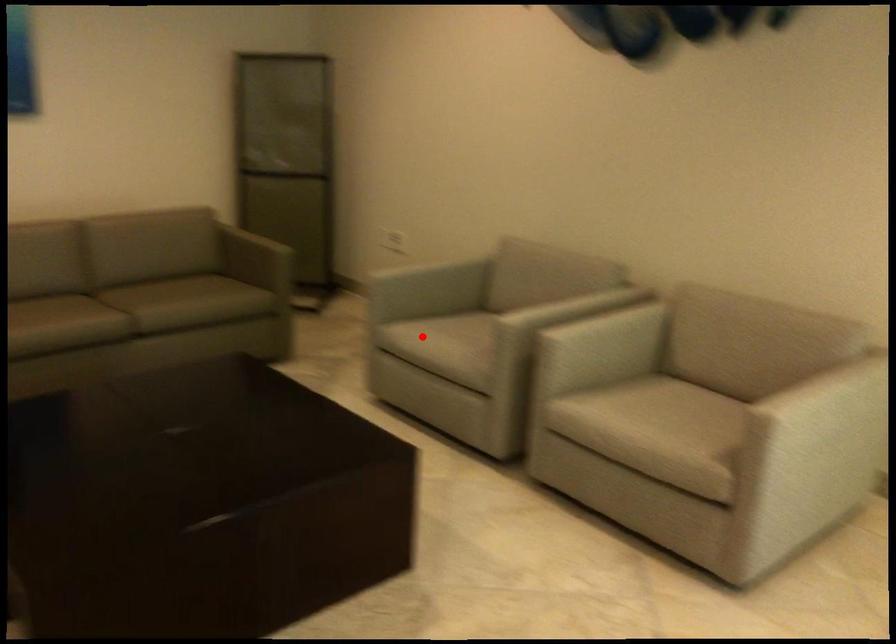
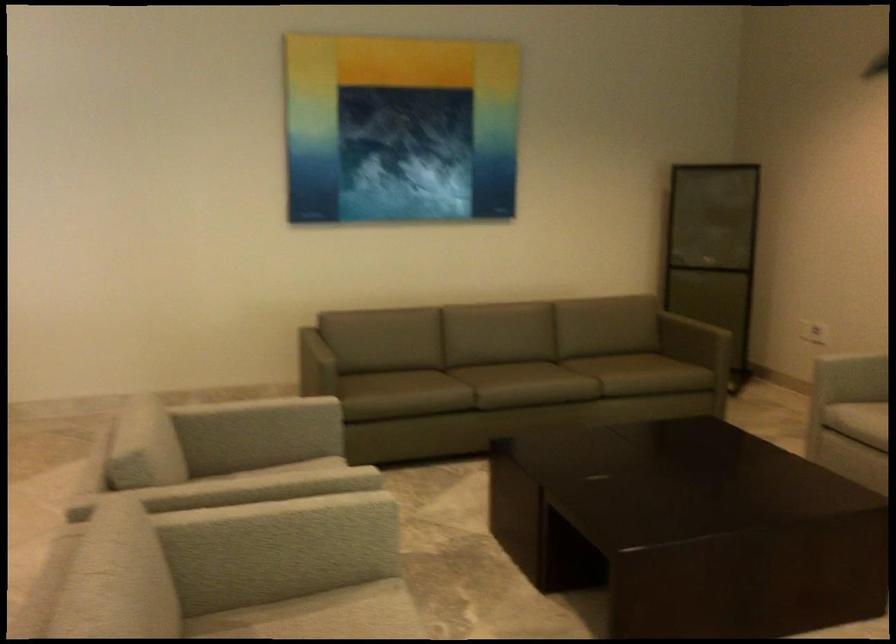
In the second image, find the point that corresponds to the highlighted location in the first image.

(857, 420)